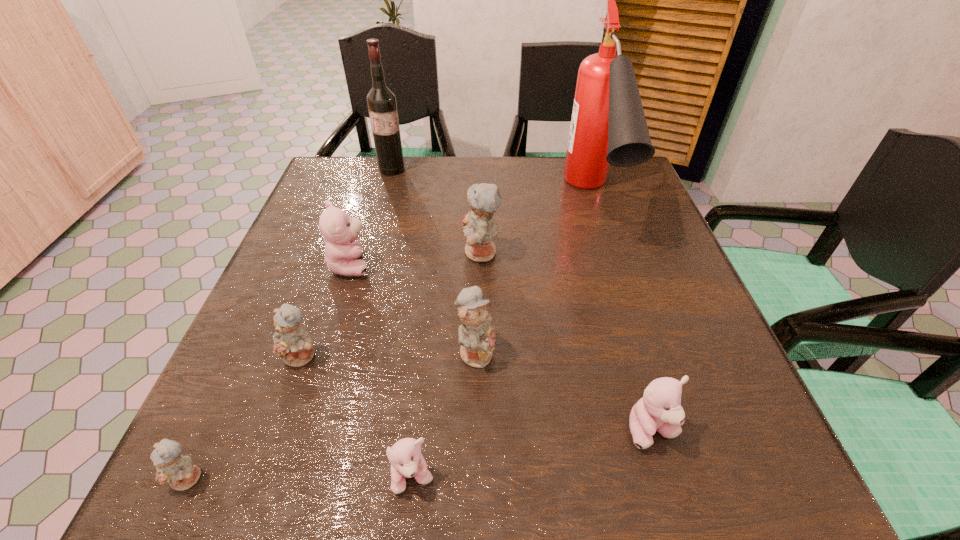
You are a GUI agent. You are given a task and a screenshot of the screen. Output one action in this format:
    pyautogui.click(x=<x>, y=<y>)
    Task: Click on the vacant area between the biggest blue teddy bear and the second blue teddy bear from left to right
    The height and width of the screenshot is (540, 960).
    Given the screenshot: What is the action you would take?
    pyautogui.click(x=392, y=305)

The width and height of the screenshot is (960, 540). I want to click on unoccupied area between the third nearest object and the fire extinguisher, so click(x=622, y=316).

Locate an element on the screen. This screenshot has width=960, height=540. free area in between the farthest pink teddy bear and the farthest blue teddy bear is located at coordinates (416, 259).

Image resolution: width=960 pixels, height=540 pixels. I want to click on free area in between the nearest blue teddy bear and the farthest pink teddy bear, so click(x=270, y=372).

Where is `vacant area that lies between the second tallest object and the second biggest blue teddy bear`? The height and width of the screenshot is (540, 960). vacant area that lies between the second tallest object and the second biggest blue teddy bear is located at coordinates (434, 260).

Identify the location of free space that is in between the second smallest blue teddy bear and the seventh shortest object. (392, 305).

The width and height of the screenshot is (960, 540). I want to click on vacant region between the second blue teddy bear from left to right and the leftmost blue teddy bear, so click(x=246, y=417).

Identify the location of free space between the second biggest blue teddy bear and the nearest blue teddy bear. (332, 415).

In order to click on blank region between the third tallest object and the second blue teddy bear from left to right in this screenshot , I will do `click(392, 305)`.

Where is `object identified as the closest to the seventh shortest object`? This screenshot has width=960, height=540. object identified as the closest to the seventh shortest object is located at coordinates (475, 335).